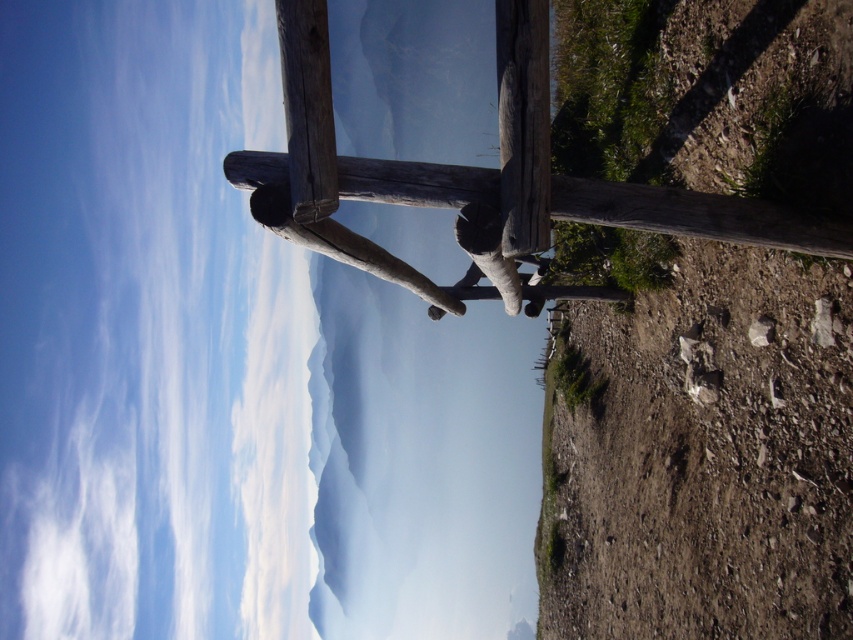
Can you confirm if brown rough wood post at right is positioned to the right of weathered wood rail at center?

Correct, you'll find brown rough wood post at right to the right of weathered wood rail at center.

Is point (634, 481) positioned in front of point (611, 205)?

No, it is not.

Which is in front, point (753, 33) or point (442, 193)?

Point (442, 193) is more forward.

Identify the location of brown rough wood post at right. The image size is (853, 640). (701, 451).

Does brown rough wood post at right come behind weathered wood pole at center?

Yes, it is behind weathered wood pole at center.

Image resolution: width=853 pixels, height=640 pixels. I want to click on brown rough wood post at right, so click(x=701, y=451).

Between point (788, 218) and point (318, 211), which one is positioned in front?

Point (318, 211) is in front.

Which is below, weathered wood rail at center or weathered wood pole at center?

weathered wood rail at center

Where is `weathered wood rail at center`? The width and height of the screenshot is (853, 640). weathered wood rail at center is located at coordinates (695, 216).